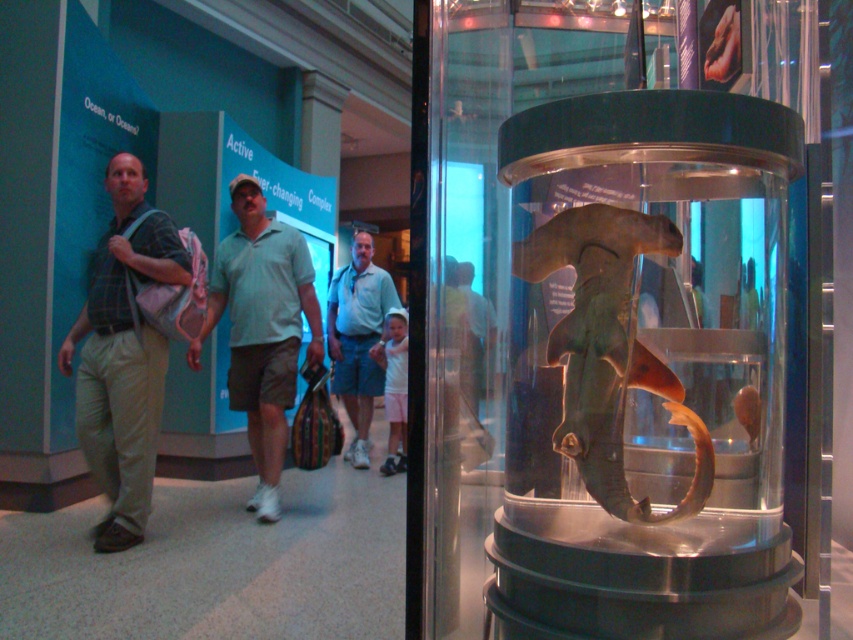
Can you confirm if plaid fabric shirt at left is positioned to the right of light green cotton shirt at center?

In fact, plaid fabric shirt at left is to the left of light green cotton shirt at center.

Which is behind, point (120, 225) or point (360, 264)?

The point (360, 264) is more distant.

Where is `plaid fabric shirt at left`? The image size is (853, 640). plaid fabric shirt at left is located at coordinates (123, 356).

Describe the element at coordinates (608, 348) in the screenshot. I see `translucent green shark at center` at that location.

Does translucent green shark at center have a lesser height compared to light gray cotton polo shirt at center?

Yes.

Is point (583, 355) less distant than point (247, 280)?

Yes, it is.

This screenshot has width=853, height=640. I want to click on translucent green shark at center, so click(x=608, y=348).

Who is taller, translucent green shark at center or plaid fabric shirt at left?

plaid fabric shirt at left

The image size is (853, 640). What do you see at coordinates (608, 348) in the screenshot?
I see `translucent green shark at center` at bounding box center [608, 348].

At what (x,y) coordinates should I click in order to perform the action: click on translucent green shark at center. Please return your answer as a coordinate pair (x, y). The image size is (853, 640). Looking at the image, I should click on (608, 348).